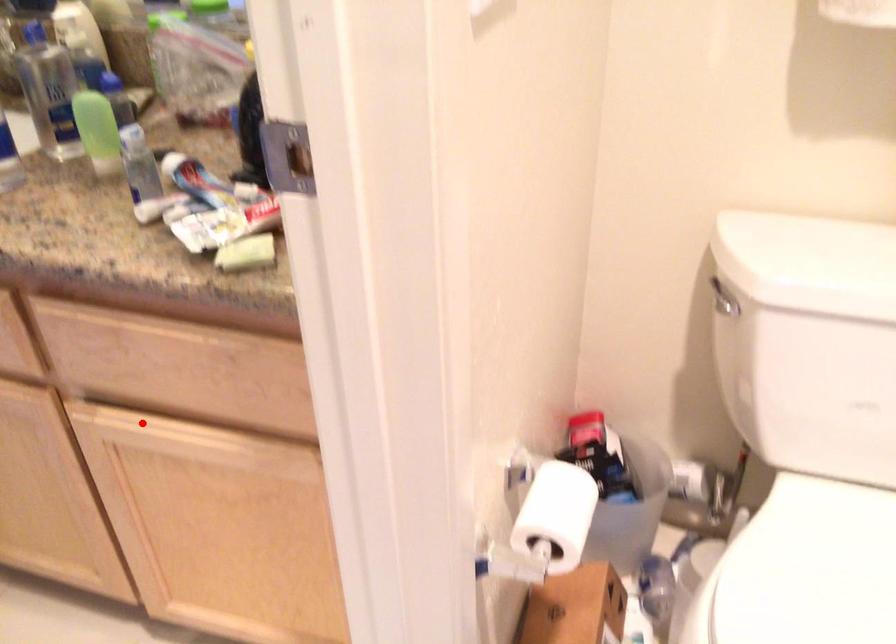
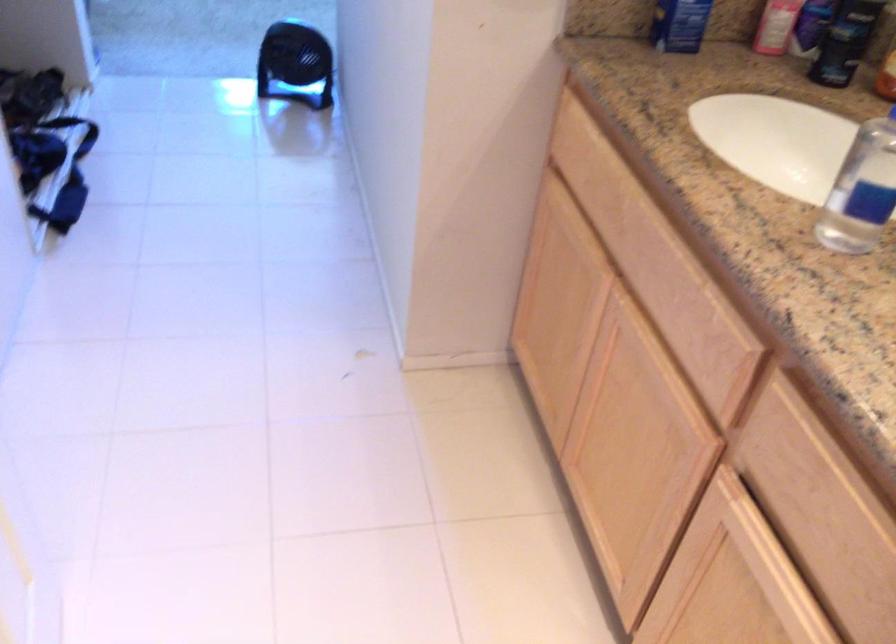
Question: I am providing you with two images of the same scene from different viewpoints. A red point is marked on the first image. At the location where the point appears in image 1, is it still visible in image 2?

Choices:
 (A) Yes
 (B) No

Answer: (A)